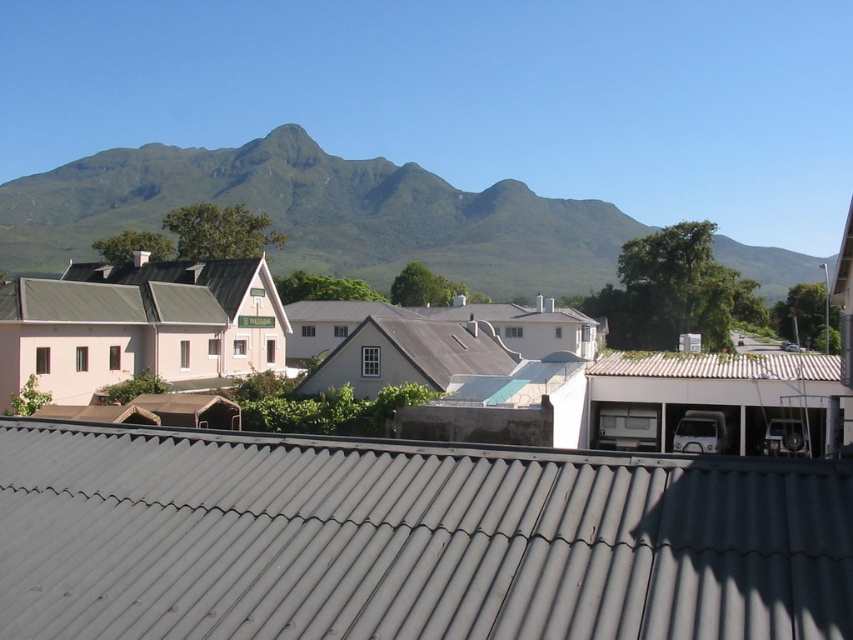
You are standing in the town square and want to take a photo of the metallic corrugated roof at center and the green grassy mountain at upper center. Which object will appear higher in your photo?

The green grassy mountain at upper center will appear higher in the photo because it is located above the metallic corrugated roof at center.

You are standing in the town square and want to take a photo of both the green grassy mountain at upper center and the metallic corrugated roof at center. Which object should you adjust your camera focus on first to ensure both are in the same frame?

You should focus on the metallic corrugated roof at center first because it is closer to you than the green grassy mountain at upper center, so adjusting focus on the closer object ensures both will be in focus when using a wide enough aperture or adjusting the focal plane appropriately.